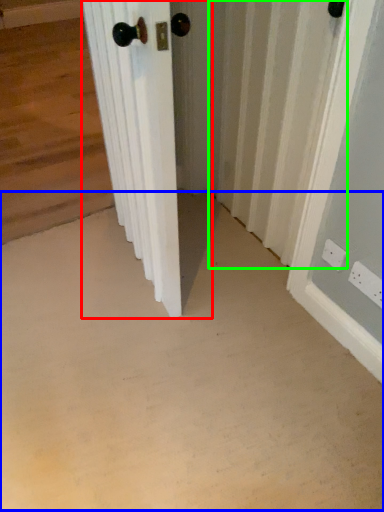
Question: Which object is positioned closest to door (highlighted by a red box)? Select from concrete (highlighted by a blue box) and radiator (highlighted by a green box).

Choices:
 (A) concrete
 (B) radiator

Answer: (A)